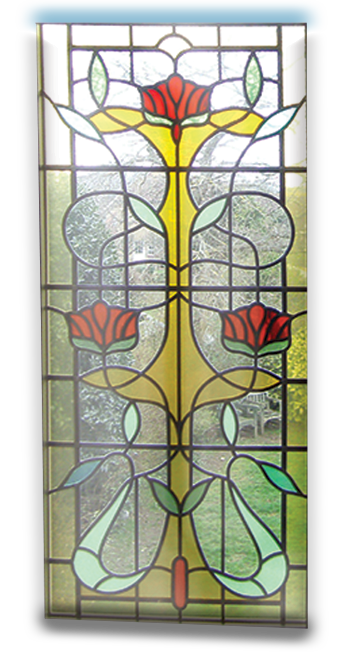
Where is `red stained glass flowers`? The width and height of the screenshot is (347, 662). red stained glass flowers is located at coordinates tap(177, 111), tap(101, 331), tap(258, 330).